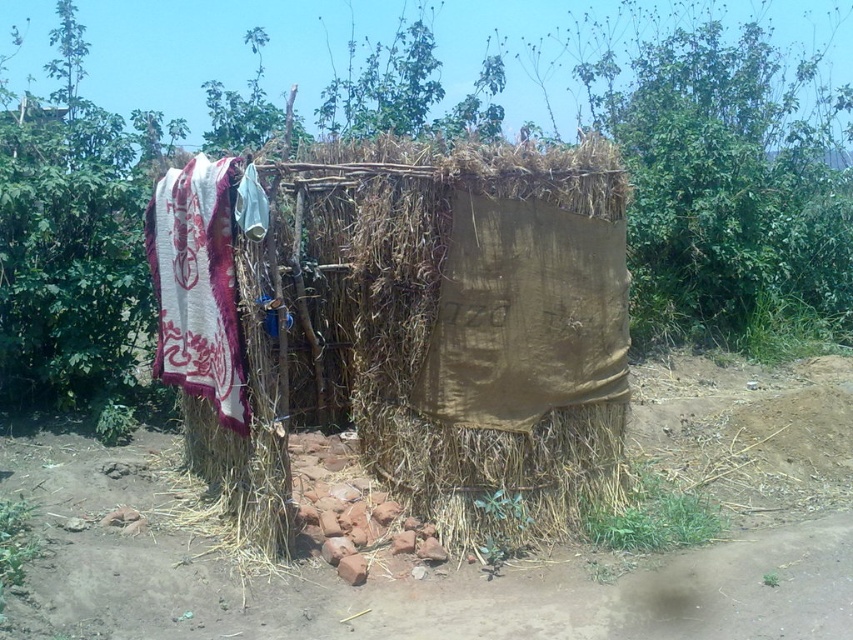
Looking at this image, is brown dirt field at lower left positioned at the back of burlap cloth at center?

No, it is not.

Is point (167, 472) positioned in front of point (276, 500)?

No, (167, 472) is behind (276, 500).

Where is `brown dirt field at lower left`? The width and height of the screenshot is (853, 640). brown dirt field at lower left is located at coordinates (476, 561).

Which of these two, burlap cloth at center or white woven cloth at left, stands taller?

burlap cloth at center is taller.

You are a GUI agent. You are given a task and a screenshot of the screen. Output one action in this format:
    pyautogui.click(x=<x>, y=<y>)
    Task: Click on the burlap cloth at center
    The width and height of the screenshot is (853, 640).
    Given the screenshot: What is the action you would take?
    pyautogui.click(x=486, y=326)

Between burlap cloth at center and brown fabric at center, which one has less height?

With less height is brown fabric at center.

Does burlap cloth at center have a lesser height compared to brown fabric at center?

No, burlap cloth at center is not shorter than brown fabric at center.

Identify the location of burlap cloth at center. The image size is (853, 640). (486, 326).